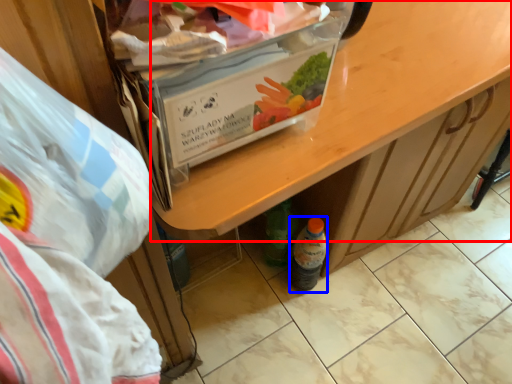
Question: Among these objects, which one is nearest to the camera, desk (highlighted by a red box) or bottle (highlighted by a blue box)?

Choices:
 (A) desk
 (B) bottle

Answer: (A)